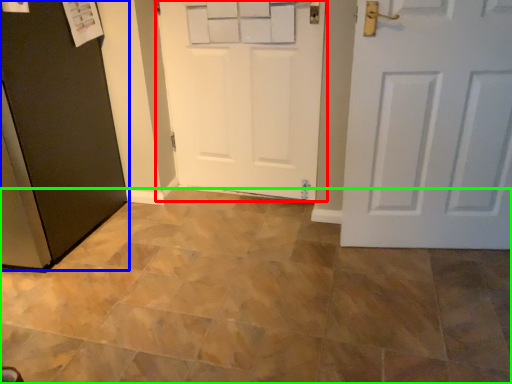
Question: Considering the real-world distances, which object is farthest from door (highlighted by a red box)? door (highlighted by a blue box) or ceramic tile (highlighted by a green box)?

Choices:
 (A) door
 (B) ceramic tile

Answer: (B)